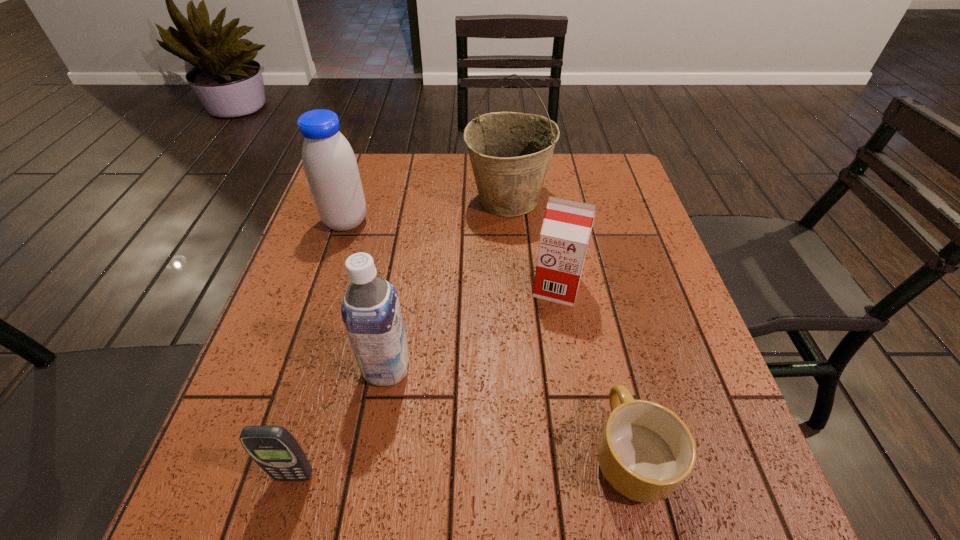
Locate an element on the screen. The height and width of the screenshot is (540, 960). free space located on the label of the fourth object from right to left is located at coordinates pos(490,368).

In order to click on vacant space located on the left of the shortest soya milk in this screenshot , I will do `click(420, 287)`.

Find the location of a particular element. This screenshot has height=540, width=960. free location located 0.380m on the side with the handle of the mug is located at coordinates (586, 263).

At what (x,y) coordinates should I click in order to perform the action: click on vacant space located 0.370m on the side with the handle of the mug. Please return your answer as a coordinate pair (x, y). The height and width of the screenshot is (540, 960). Looking at the image, I should click on (586, 266).

Identify the location of free region located on the side with the handle of the mug. Image resolution: width=960 pixels, height=540 pixels. (602, 332).

Where is `object situated at the far edge`? object situated at the far edge is located at coordinates (510, 152).

The width and height of the screenshot is (960, 540). In order to click on cellular telephone situated at the near edge in this screenshot , I will do `click(273, 448)`.

The image size is (960, 540). I want to click on mug that is positioned at the near edge, so click(645, 452).

Locate an element on the screen. The image size is (960, 540). soya milk that is at the left edge is located at coordinates (330, 166).

The image size is (960, 540). Identify the location of cellular telephone that is positioned at the left edge. (273, 448).